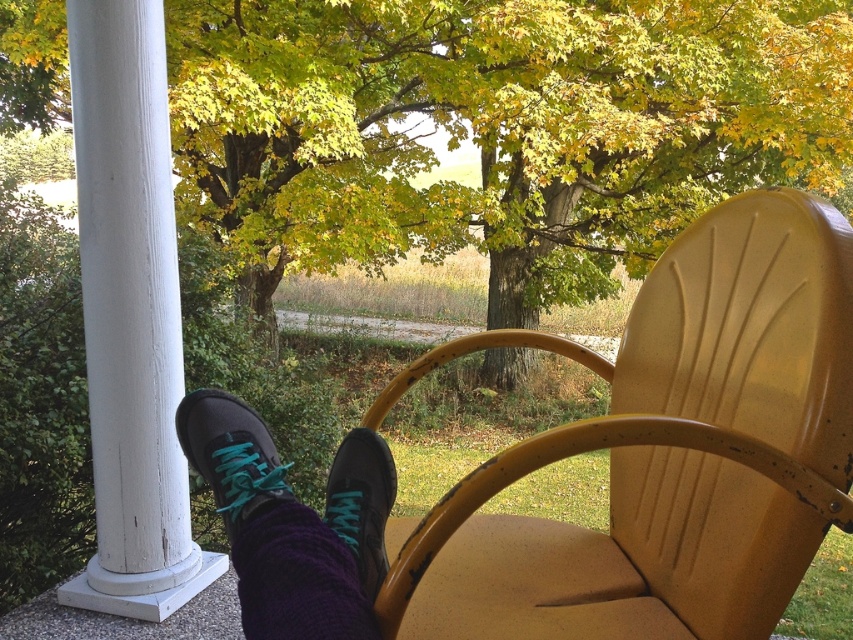
How far apart are matte yellow plastic chair at center and matte black sneaker at lower left?

matte yellow plastic chair at center is 53.41 centimeters away from matte black sneaker at lower left.

Does matte yellow plastic chair at center have a greater height compared to matte black sneaker at lower left?

Yes, matte yellow plastic chair at center is taller than matte black sneaker at lower left.

Who is more forward, (577, 445) or (228, 444)?

Positioned in front is point (228, 444).

Locate an element on the screen. This screenshot has height=640, width=853. matte yellow plastic chair at center is located at coordinates (664, 452).

Can you confirm if green leafy tree at upper center is taller than matte black sneaker at lower left?

Yes, green leafy tree at upper center is taller than matte black sneaker at lower left.

Does green leafy tree at upper center have a lesser width compared to matte black sneaker at lower left?

No.

Is point (206, 45) less distant than point (213, 452)?

No, (206, 45) is behind (213, 452).

Identify the location of green leafy tree at upper center. (496, 128).

Does matte yellow plastic chair at center appear under purple knitted sock at lower center?

No.

Who is taller, matte yellow plastic chair at center or purple knitted sock at lower center?

With more height is matte yellow plastic chair at center.

Who is more distant from viewer, [463,528] or [254,577]?

Point [463,528]

This screenshot has height=640, width=853. I want to click on matte yellow plastic chair at center, so click(x=664, y=452).